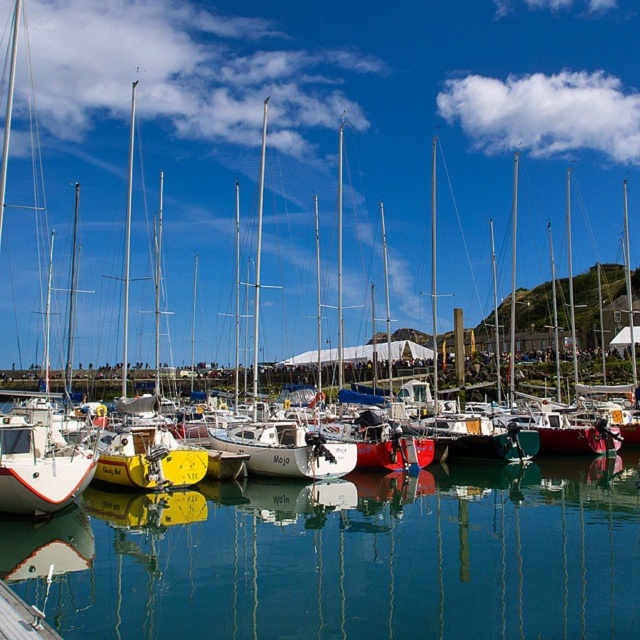
You are standing on the dock and looking at the clear glass water at center and the white matte sailboat at center. Which object is closer to you?

The clear glass water at center is closer to you because it is in front of the white matte sailboat at center.

You are standing at the edge of the marina and notice the clear glass water at center and the white matte sailboat at left. Which object appears taller from your viewpoint?

The white matte sailboat at left appears taller than the clear glass water at center because the description states that the clear glass water at center has a lesser height compared to the white matte sailboat at left.